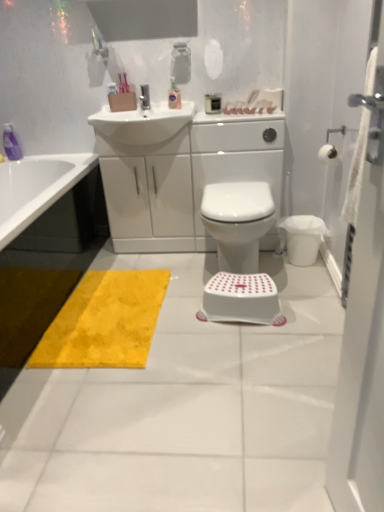
At what (x,y) coordinates should I click in order to perform the action: click on vacant area in front of white plastic bidet at center. Please return your answer as a coordinate pair (x, y). The image size is (384, 512). Looking at the image, I should click on (263, 323).